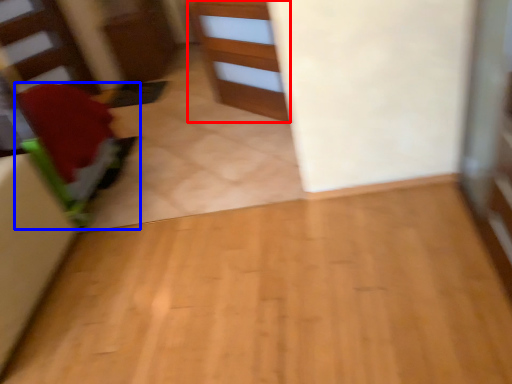
Question: Which of the following is the farthest to the observer, cabinetry (highlighted by a red box) or furniture (highlighted by a blue box)?

Choices:
 (A) cabinetry
 (B) furniture

Answer: (A)